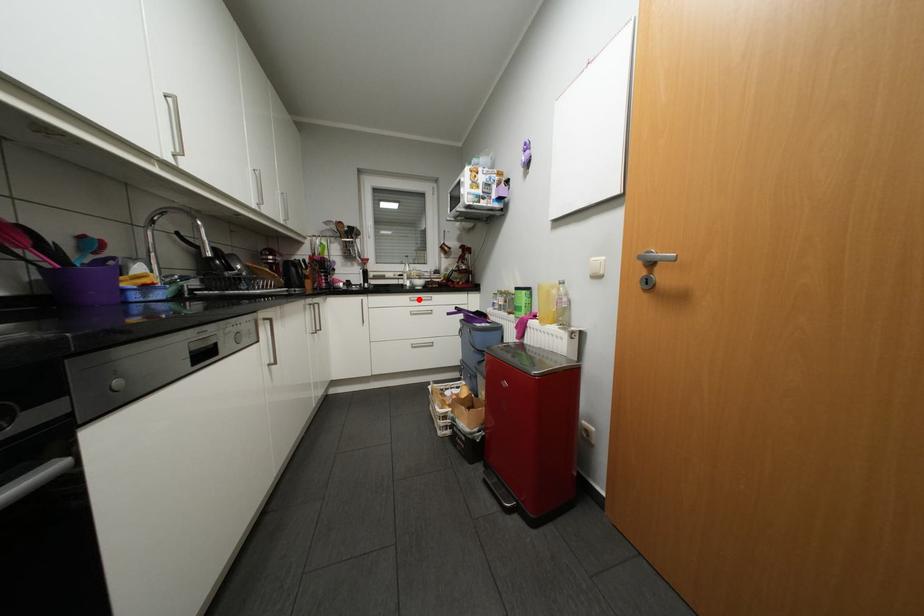
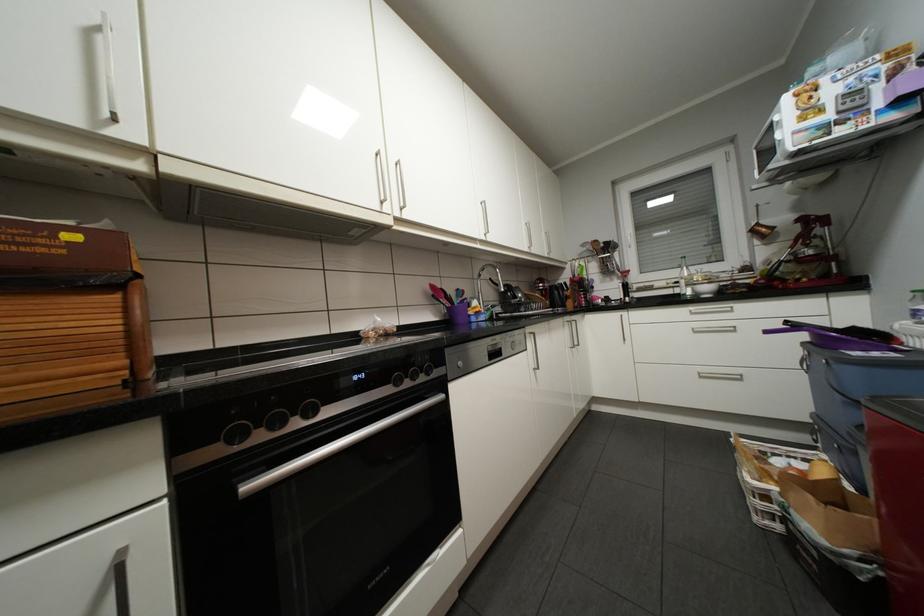
Find the pixel in the second image that matches the highlighted location in the first image.

(699, 313)